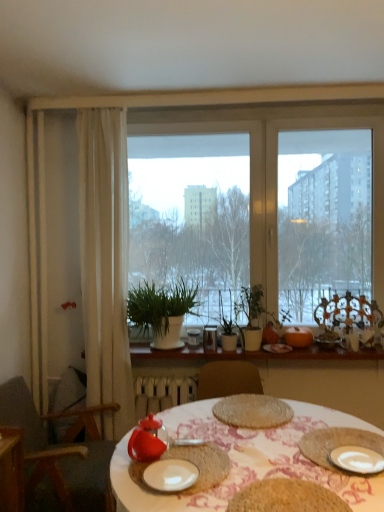
At what (x,y) coordinates should I click in order to perform the action: click on vacant area on top of white matte plate at center, which ranks as the 2th plate in right-to-left order (from a real-world perspective). Please return your answer as a coordinate pair (x, y). Looking at the image, I should click on (172, 471).